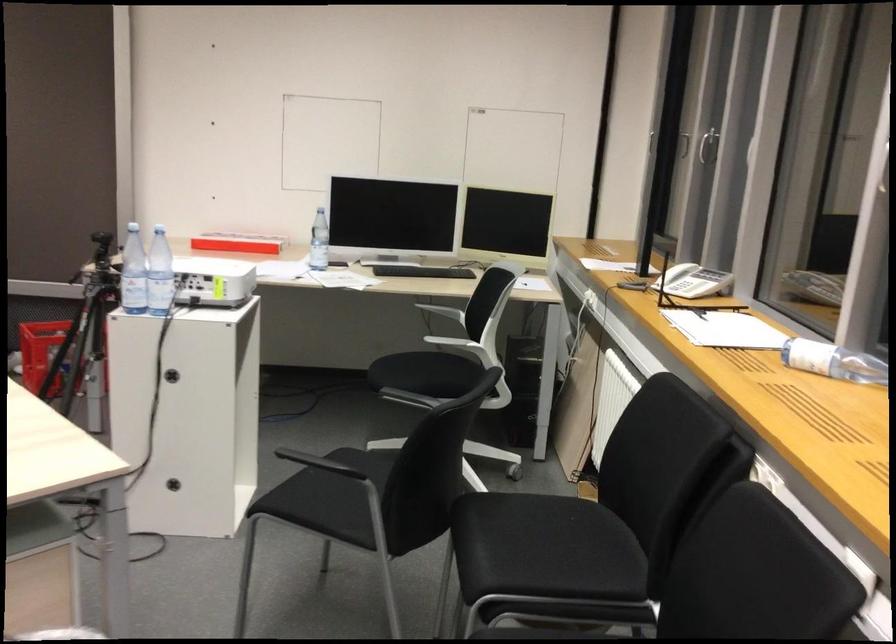
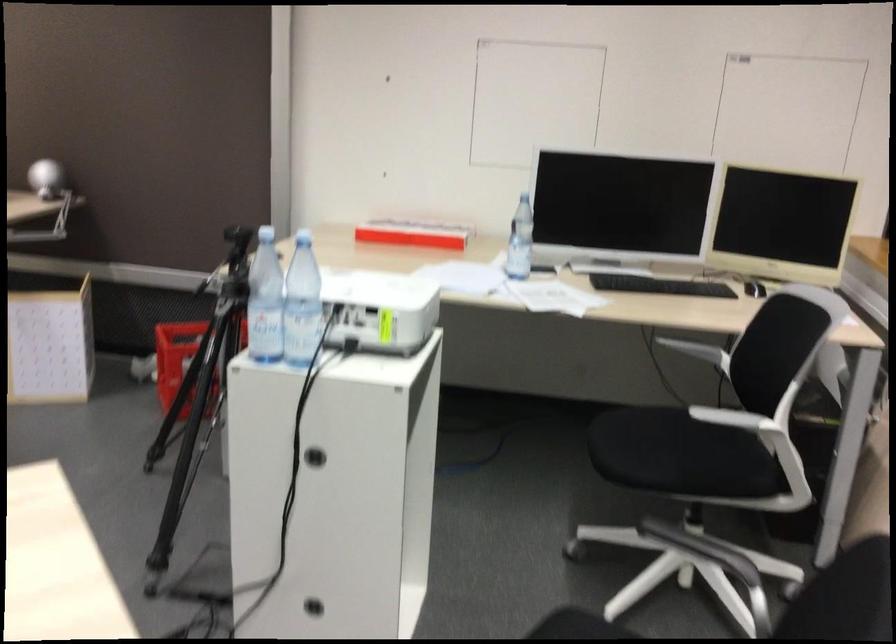
The point at (426, 372) is marked in the first image. Where is the corresponding point in the second image?

(679, 455)